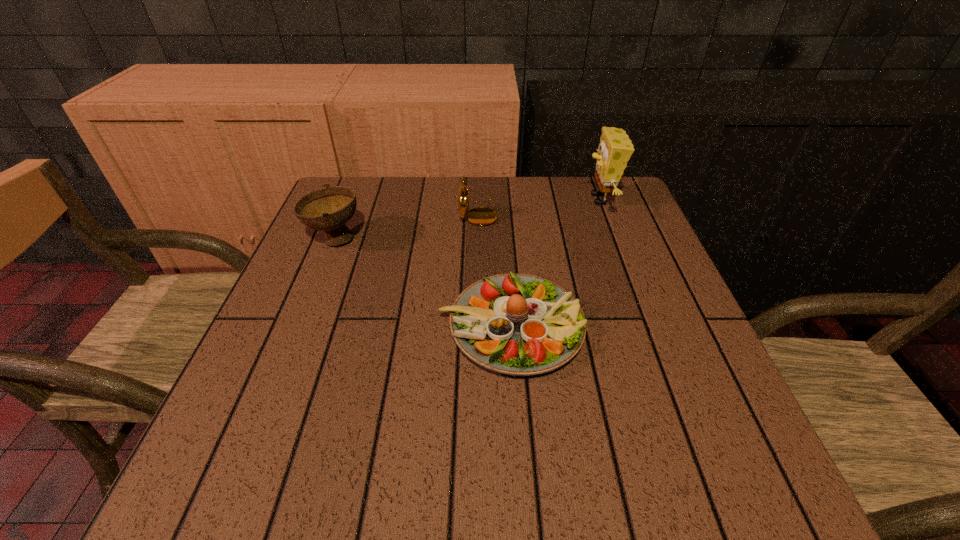
I want to click on free space at the near edge of the desktop, so click(373, 492).

In the image, there is a desktop. Where is `vacant region at the left edge`? The image size is (960, 540). vacant region at the left edge is located at coordinates (339, 290).

You are a GUI agent. You are given a task and a screenshot of the screen. Output one action in this format:
    pyautogui.click(x=<x>, y=<y>)
    Task: Click on the vacant space at the right edge of the desktop
    This screenshot has width=960, height=540.
    Given the screenshot: What is the action you would take?
    pyautogui.click(x=660, y=347)

Locate an element on the screen. The width and height of the screenshot is (960, 540). free location at the far left corner of the desktop is located at coordinates (367, 201).

The height and width of the screenshot is (540, 960). I want to click on free space at the near left corner of the desktop, so click(x=225, y=504).

Where is `vacant space at the far right corner`? Image resolution: width=960 pixels, height=540 pixels. vacant space at the far right corner is located at coordinates (630, 211).

You are a GUI agent. You are given a task and a screenshot of the screen. Output one action in this format:
    pyautogui.click(x=<x>, y=<y>)
    Task: Click on the free area in between the soup bowl and the pocket watch
    This screenshot has height=540, width=960.
    Given the screenshot: What is the action you would take?
    pyautogui.click(x=406, y=226)

Where is `free spot between the leftmost object and the pocket watch`? Image resolution: width=960 pixels, height=540 pixels. free spot between the leftmost object and the pocket watch is located at coordinates (406, 226).

Locate an element on the screen. The height and width of the screenshot is (540, 960). empty space between the sponge and the salad plate is located at coordinates (556, 263).

Locate an element on the screen. blank region between the nearest object and the pocket watch is located at coordinates (494, 269).